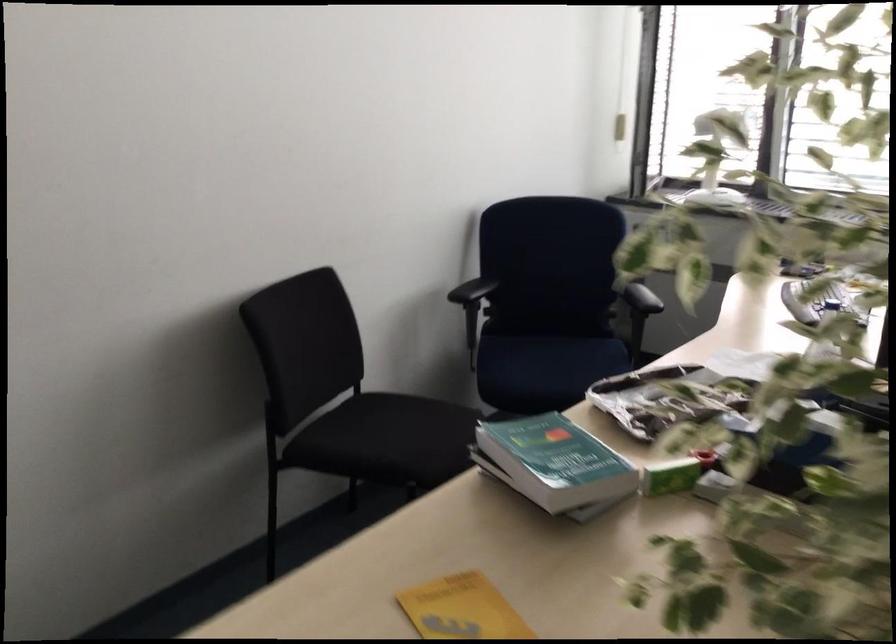
The height and width of the screenshot is (644, 896). Describe the element at coordinates (377, 436) in the screenshot. I see `the black chair sitting surface` at that location.